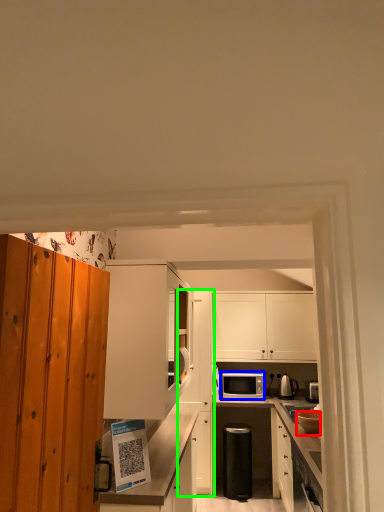
Question: Estimate the real-world distances between objects in this image. Which object is farther from appliance (highlighted by a red box), microwave oven (highlighted by a blue box) or cabinetry (highlighted by a green box)?

Choices:
 (A) microwave oven
 (B) cabinetry

Answer: (B)